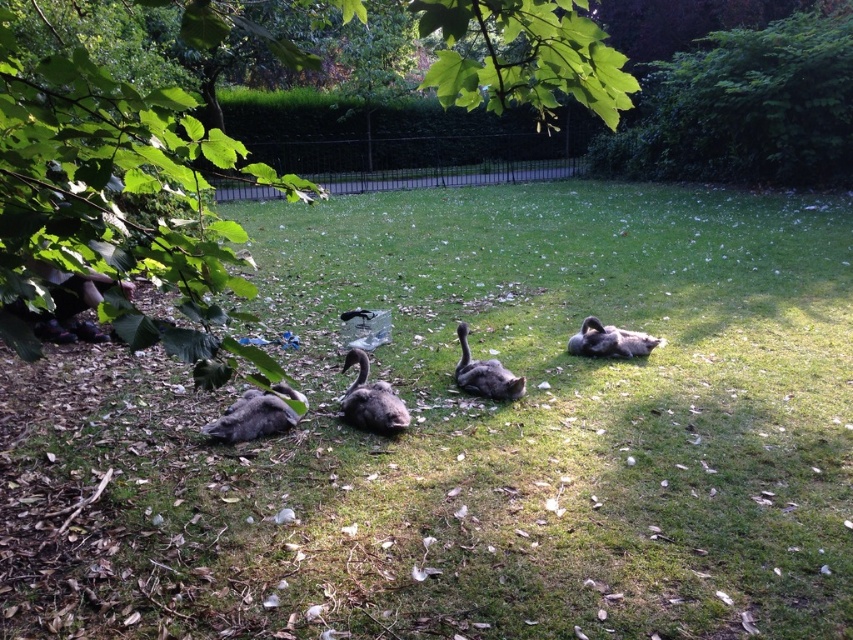
Is point (105, 241) closer to viewer compared to point (270, 417)?

Yes, point (105, 241) is closer to viewer.

Is green leafy tree at center thinner than dark gray downy duckling at lower left?

Incorrect, green leafy tree at center's width is not less than dark gray downy duckling at lower left's.

Is point (163, 257) positioned in front of point (274, 413)?

That is True.

At what (x,y) coordinates should I click in order to perform the action: click on green leafy tree at center. Please return your answer as a coordinate pair (x, y). This screenshot has height=640, width=853. Looking at the image, I should click on (119, 189).

Can you confirm if dark gray downy duckling at lower left is wider than gray downy goose at center?

Yes, dark gray downy duckling at lower left is wider than gray downy goose at center.

Between dark gray downy duckling at lower left and gray downy goose at center, which one has less height?

Standing shorter between the two is dark gray downy duckling at lower left.

Image resolution: width=853 pixels, height=640 pixels. What do you see at coordinates (251, 417) in the screenshot? I see `dark gray downy duckling at lower left` at bounding box center [251, 417].

Identify the location of dark gray downy duckling at lower left. The height and width of the screenshot is (640, 853). (251, 417).

Consider the image. Who is more forward, (x=296, y=529) or (x=190, y=300)?

Point (x=190, y=300) is more forward.

Is green grassy at center further to camera compared to green leafy tree at center?

Yes, green grassy at center is behind green leafy tree at center.

Is point (300, 353) positioned after point (515, 48)?

No, it is not.

Identify the location of green grassy at center. This screenshot has width=853, height=640. (469, 435).